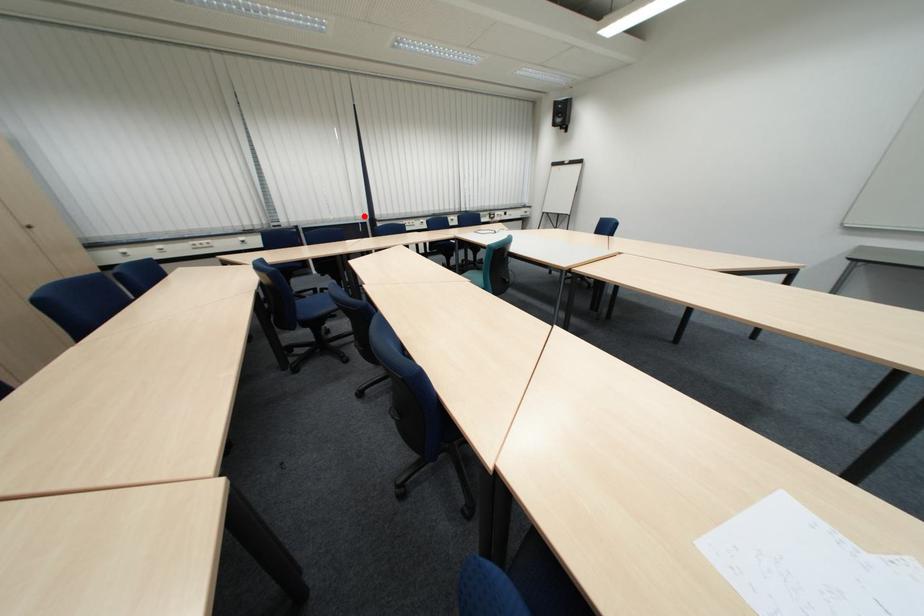
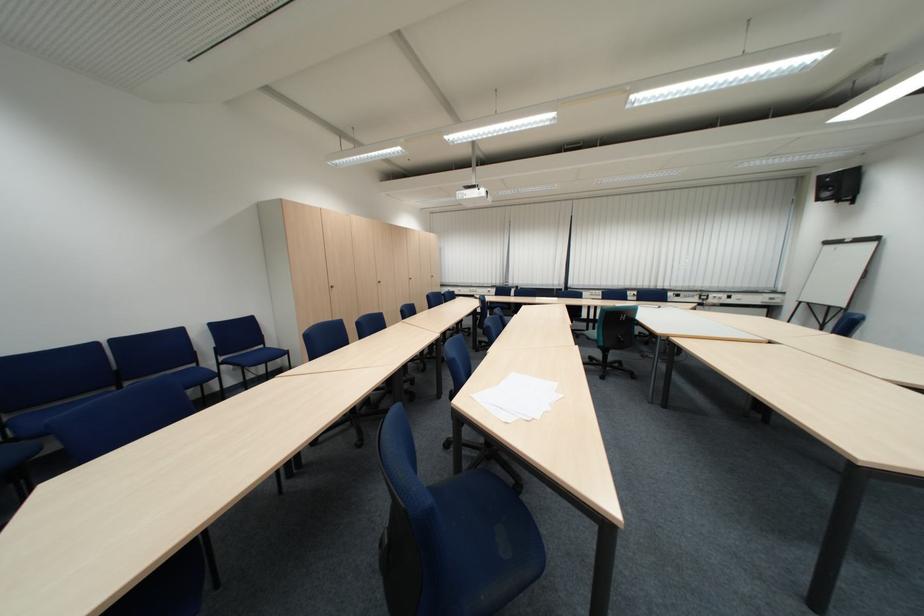
Where in the second image is the point corresponding to the highlighted location from the first image?

(564, 284)